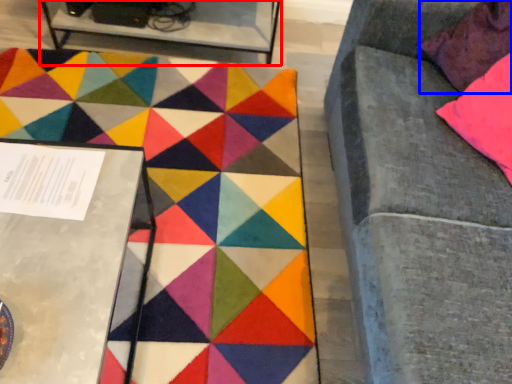
Question: Which of the following is the farthest to the observer, table (highlighted by a red box) or pillow (highlighted by a blue box)?

Choices:
 (A) table
 (B) pillow

Answer: (A)